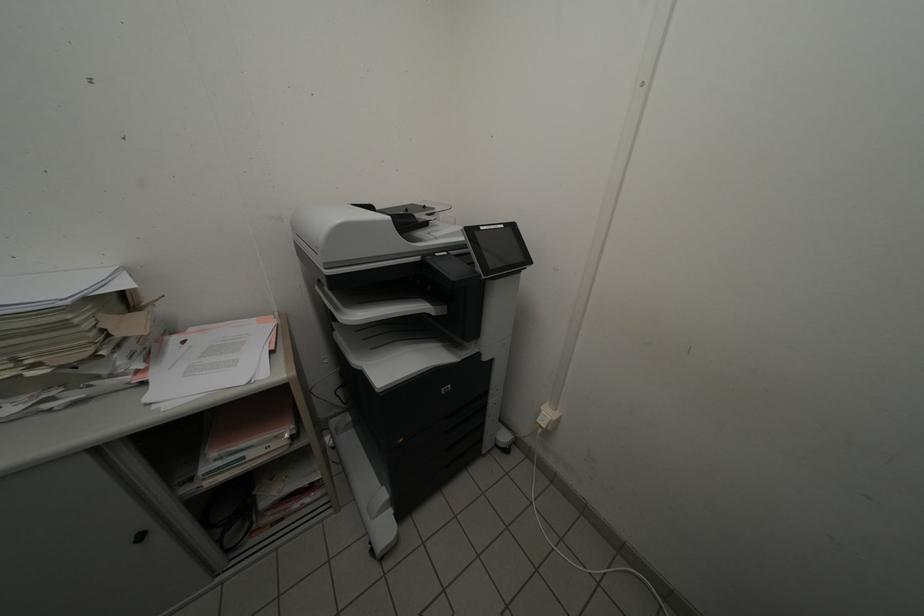
Which object does [548,416] point to?

It refers to a white electrical plug.